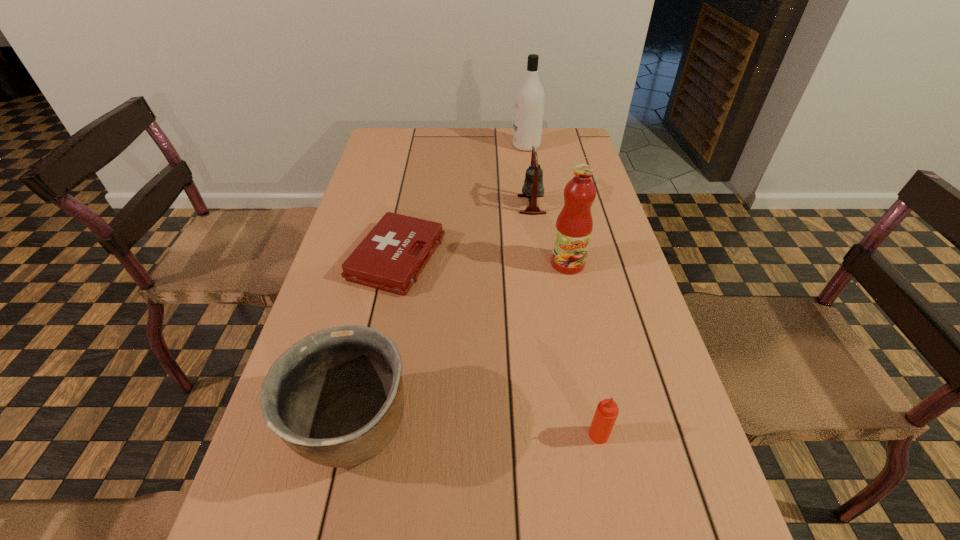
The height and width of the screenshot is (540, 960). In order to click on object that stands as the fifth closest to the shortest object in this screenshot , I will do `click(530, 98)`.

At what (x,y) coordinates should I click in order to perform the action: click on object that is the closest to the pottery. Please return your answer as a coordinate pair (x, y). Image resolution: width=960 pixels, height=540 pixels. Looking at the image, I should click on (390, 258).

This screenshot has width=960, height=540. Find the location of `vacant area that satisfies the following two spatial constraints: 1. on the front side of the shortest object; 2. on the right side of the second shortest object`. vacant area that satisfies the following two spatial constraints: 1. on the front side of the shortest object; 2. on the right side of the second shortest object is located at coordinates (361, 435).

The image size is (960, 540). Find the location of `free point that satisfies the following two spatial constraints: 1. on the front-facing side of the farthest object; 2. on the front side of the pottery`. free point that satisfies the following two spatial constraints: 1. on the front-facing side of the farthest object; 2. on the front side of the pottery is located at coordinates (570, 428).

This screenshot has width=960, height=540. What are the coordinates of `free space that satisfies the following two spatial constraints: 1. on the front-facing side of the farthest object; 2. on the left side of the Tabasco sauce` in the screenshot? It's located at (571, 435).